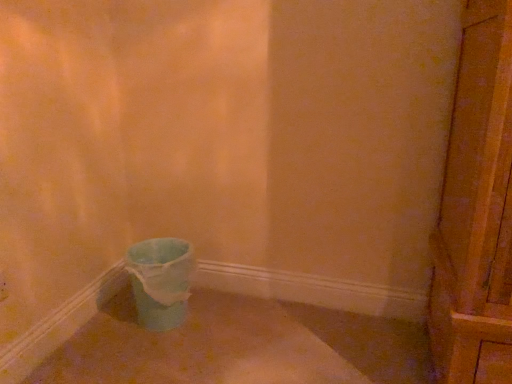
This screenshot has height=384, width=512. What do you see at coordinates (160, 281) in the screenshot? I see `teal matte plastic potty at lower left` at bounding box center [160, 281].

Image resolution: width=512 pixels, height=384 pixels. What are the coordinates of `teal matte plastic potty at lower left` in the screenshot? It's located at (160, 281).

In the scene shown: What is the approximate width of teal matte plastic potty at lower left?

teal matte plastic potty at lower left is 29.60 centimeters in width.

The image size is (512, 384). What are the coordinates of `teal matte plastic potty at lower left` in the screenshot? It's located at (160, 281).